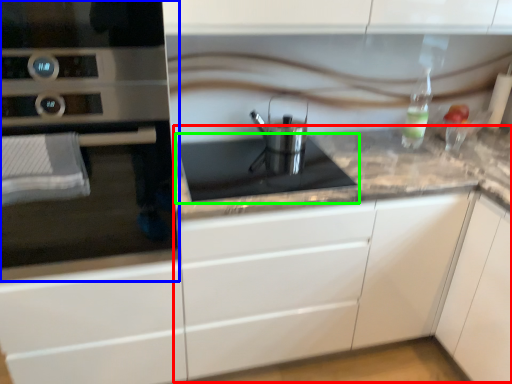
Question: Which object is the farthest from counter (highlighted by a red box)? Choose among these: home appliance (highlighted by a blue box) or gas stove (highlighted by a green box).

Choices:
 (A) home appliance
 (B) gas stove

Answer: (A)